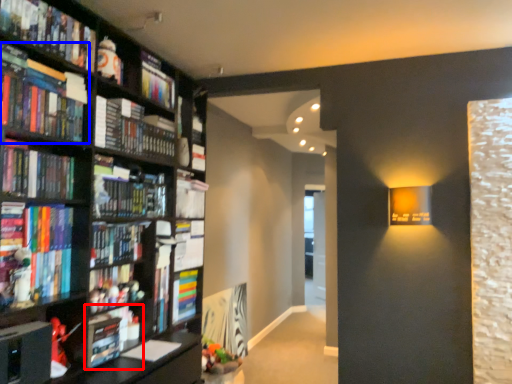
Question: Which object appears farthest to the camera in this image, book (highlighted by a red box) or book (highlighted by a blue box)?

Choices:
 (A) book
 (B) book

Answer: (A)